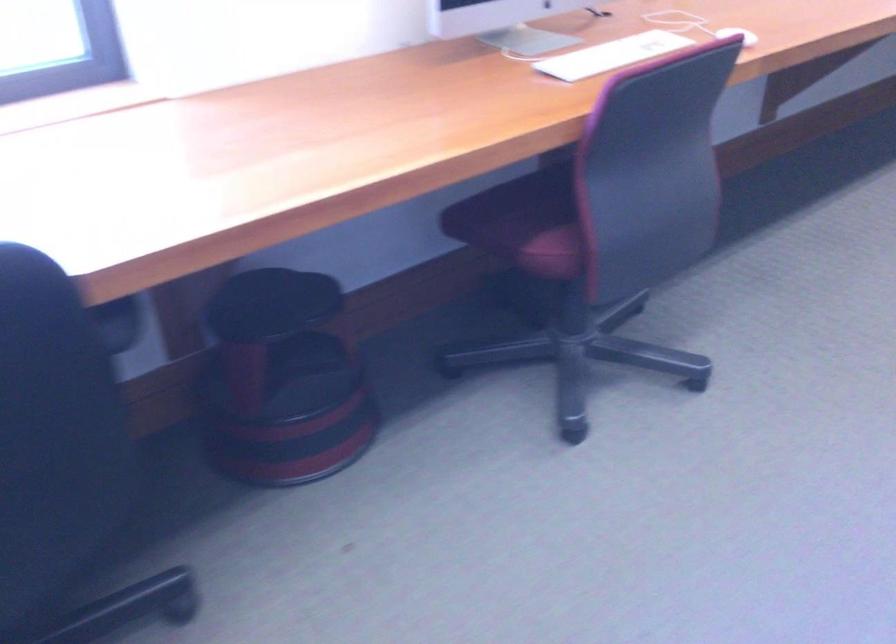
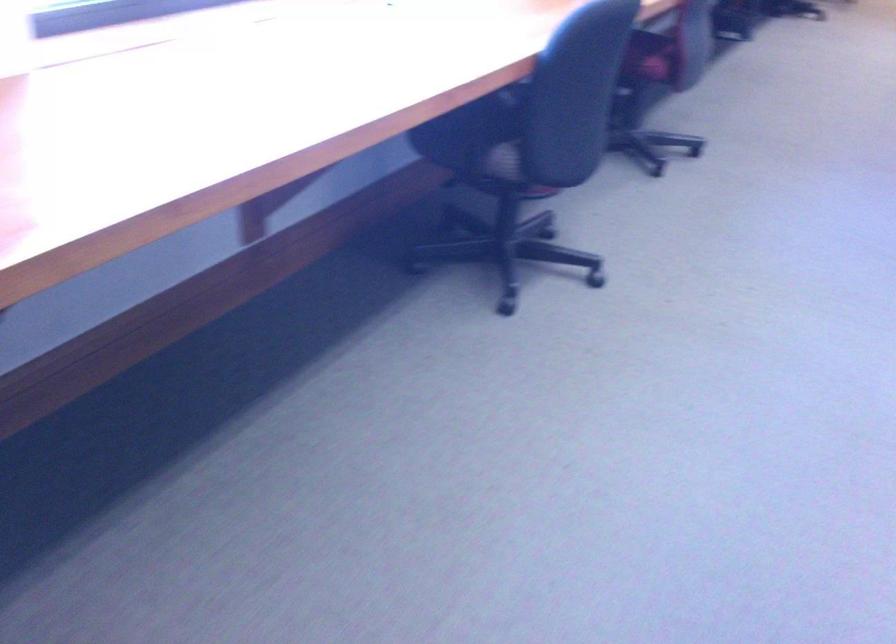
What movement of the cameraman would produce the second image?

The cameraman moved toward left, backward.